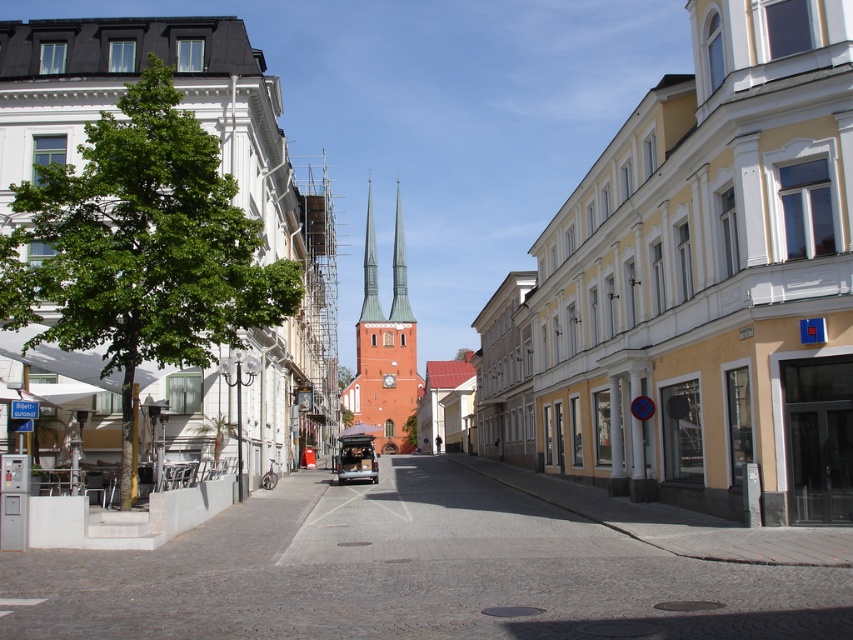
Who is lower down, red brick spire at center or metallic silver van at center?

metallic silver van at center is below.

Which is more to the right, red brick spire at center or metallic silver van at center?

metallic silver van at center

Between point (392, 412) and point (350, 458), which one is positioned behind?

Positioned behind is point (392, 412).

I want to click on red brick spire at center, so click(386, 348).

Does yellow painted building at right appear under red brick spire at center?

Yes, yellow painted building at right is below red brick spire at center.

Does yellow painted building at right have a larger size compared to red brick spire at center?

No.

Does point (776, 385) lie behind point (392, 384)?

No.

At what (x,y) coordinates should I click in order to perform the action: click on yellow painted building at right. Please return your answer as a coordinate pair (x, y). The image size is (853, 640). Looking at the image, I should click on (711, 278).

The image size is (853, 640). What do you see at coordinates (711, 278) in the screenshot? I see `yellow painted building at right` at bounding box center [711, 278].

Which of these two, yellow painted building at right or metallic silver van at center, stands shorter?

metallic silver van at center

Who is more distant from viewer, (735,284) or (351,460)?

Point (351,460)

The height and width of the screenshot is (640, 853). What are the coordinates of `yellow painted building at right` in the screenshot? It's located at (711, 278).